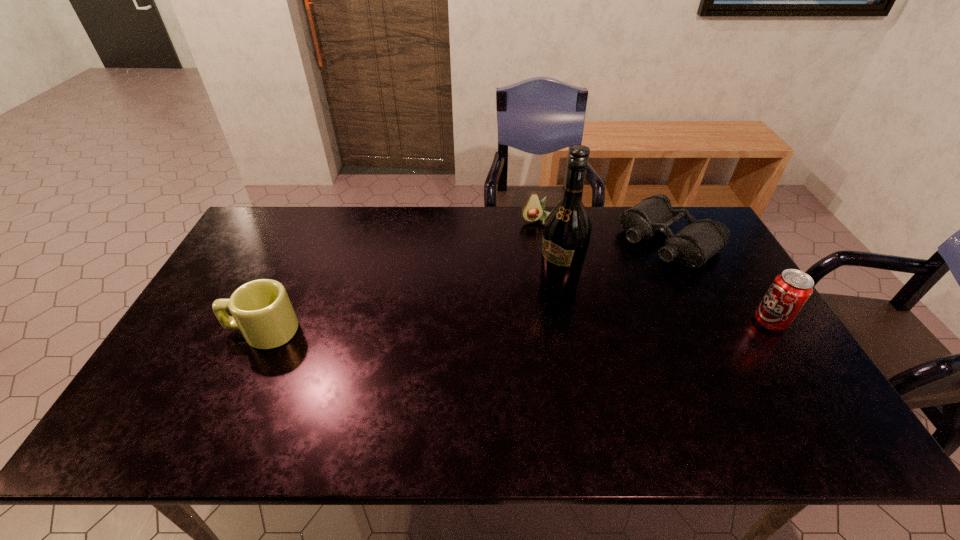
The height and width of the screenshot is (540, 960). I want to click on vacant space that satisfies the following two spatial constraints: 1. on the front side of the tallest object; 2. on the right side of the second tallest object, so click(x=564, y=322).